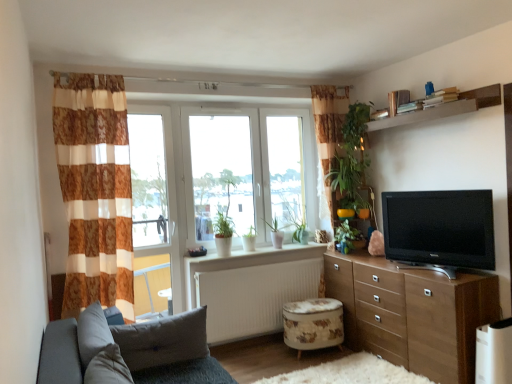
Describe the element at coordinates (227, 172) in the screenshot. I see `transparent glass window at center` at that location.

At what (x,y) coordinates should I click in order to perform the action: click on wooden chest of drawers at right. Please return your answer as a coordinate pair (x, y). Looking at the image, I should click on (413, 314).

This screenshot has width=512, height=384. Describe the element at coordinates (163, 340) in the screenshot. I see `gray fabric pillow at lower left` at that location.

What do you see at coordinates (313, 324) in the screenshot? The image size is (512, 384). I see `floral fabric ottoman at lower center` at bounding box center [313, 324].

What do you see at coordinates (296, 223) in the screenshot? I see `green matte plant at center, which is counted as the first plant, starting from the left` at bounding box center [296, 223].

Image resolution: width=512 pixels, height=384 pixels. Find the location of `transparent glass window at center`. transparent glass window at center is located at coordinates (227, 172).

Considering the relative sizes of white ceramic pots at center and wooden chest of drawers at right in the image provided, is white ceramic pots at center wider than wooden chest of drawers at right?

Incorrect, the width of white ceramic pots at center does not surpass that of wooden chest of drawers at right.

Could wooden chest of drawers at right be considered to be inside white ceramic pots at center?

That's incorrect, wooden chest of drawers at right is not inside white ceramic pots at center.

Based on the photo, from the image's perspective, is white ceramic pots at center above or below wooden chest of drawers at right?

white ceramic pots at center is above wooden chest of drawers at right.

Which is less distant, (277,257) or (423,348)?

Point (277,257) is positioned farther from the camera compared to point (423,348).

Who is taller, white plastic air purifier at lower right or wooden chest of drawers at right?

wooden chest of drawers at right is taller.

There is a white plastic air purifier at lower right. What are the coordinates of `the chest of drawers above it (from a real-world perspective)` in the screenshot? It's located at (413, 314).

Considering the relative positions of white plastic air purifier at lower right and wooden chest of drawers at right in the image provided, is white plastic air purifier at lower right to the right of wooden chest of drawers at right from the viewer's perspective?

Yes.

Between point (488, 351) and point (370, 277), which one is positioned behind?

Positioned behind is point (370, 277).

Are wooden chest of drawers at right and green matte plant at center, which is counted as the first plant, starting from the left, far apart?

That's right, there is a large distance between wooden chest of drawers at right and green matte plant at center, which is counted as the first plant, starting from the left.

Identify the location of chest of drawers lying on the right of green matte plant at center, which is counted as the first plant, starting from the left. Image resolution: width=512 pixels, height=384 pixels. (413, 314).

Do you think wooden chest of drawers at right is within green matte plant at center, which is counted as the first plant, starting from the left, or outside of it?

The correct answer is: outside.

Consider the image. Which object is more forward, floral fabric ottoman at lower center or white plastic window frame at left?

floral fabric ottoman at lower center is more forward.

Which is nearer, (328, 338) or (173, 241)?

Point (328, 338) appears to be closer to the viewer than point (173, 241).

Could you tell me if floral fabric ottoman at lower center is facing white plastic window frame at left?

No, floral fabric ottoman at lower center is not aimed at white plastic window frame at left.

From the image's perspective, would you say floral fabric ottoman at lower center is shown under white plastic window frame at left?

Indeed, from the image's perspective, floral fabric ottoman at lower center is shown beneath white plastic window frame at left.

How many degrees apart are the facing directions of white matte radiator at center and transparent glass window at center?

The angular difference between white matte radiator at center and transparent glass window at center is 0.216 degrees.

Which of these two, white matte radiator at center or transparent glass window at center, is bigger?

transparent glass window at center.

Is transparent glass window at center a part of white matte radiator at center?

No, transparent glass window at center is not surrounded by white matte radiator at center.

Between white matte radiator at center and transparent glass window at center, which one has more height?

transparent glass window at center.

Is wooden chest of drawers at right facing away from white plastic window frame at left?

No, wooden chest of drawers at right is not facing the opposite direction of white plastic window frame at left.

Considering the sizes of objects wooden chest of drawers at right and white plastic window frame at left in the image provided, who is bigger, wooden chest of drawers at right or white plastic window frame at left?

wooden chest of drawers at right is bigger.

Between wooden chest of drawers at right and white plastic window frame at left, which one is positioned behind?

white plastic window frame at left is behind.

Considering the positions of point (330, 291) and point (165, 293), is point (330, 291) closer or farther from the camera than point (165, 293)?

Clearly, point (330, 291) is closer to the camera than point (165, 293).

Can you see brown wooden shelf at upper right touching white ceramic pots at center?

They are not placed beside each other.

In the scene shown: Who is smaller, brown wooden shelf at upper right or white ceramic pots at center?

white ceramic pots at center.

Considering the relative positions of brown wooden shelf at upper right and white ceramic pots at center in the image provided, is brown wooden shelf at upper right to the left of white ceramic pots at center from the viewer's perspective?

No, brown wooden shelf at upper right is not to the left of white ceramic pots at center.

Locate an element on the screen. The image size is (512, 384). shelf above the white ceramic pots at center (from the image's perspective) is located at coordinates (444, 108).

Where is `window sill behind the wooden chest of drawers at right`? The height and width of the screenshot is (384, 512). window sill behind the wooden chest of drawers at right is located at coordinates (259, 256).

The height and width of the screenshot is (384, 512). Find the location of `appliance below the wooden chest of drawers at right (from a real-world perspective)`. appliance below the wooden chest of drawers at right (from a real-world perspective) is located at coordinates (494, 352).

Estimate the real-world distances between objects in this image. Which object is closer to gray fabric pillow at lower left, green matte plant at center, acting as the second plant starting from the right, or brown/white striped curtain at left?

Based on the image, brown/white striped curtain at left appears to be nearer to gray fabric pillow at lower left.

Considering their positions, is black glossy tv at right positioned closer to green matte plant at center, which is the first plant from back to front, than white ceramic pots at center?

white ceramic pots at center.

From the image, which object appears to be nearer to white matte radiator at center, brown wooden shelf at upper right or floral fabric ottoman at lower center?

Based on the image, floral fabric ottoman at lower center appears to be nearer to white matte radiator at center.

Consider the image. Which object lies further to the anchor point gray fabric pillow at lower left, transparent glass window at center or white plastic window frame at left?

Based on the image, transparent glass window at center appears to be further to gray fabric pillow at lower left.

Which object lies further to the anchor point white matte radiator at center, brown/white striped curtain at left or white plastic air purifier at lower right?

Based on the image, white plastic air purifier at lower right appears to be further to white matte radiator at center.

When comparing their distances from white ceramic pots at center, does white plastic air purifier at lower right or green matte plant at center, the 1th plant in the right-to-left sequence, seem further?

Based on the image, white plastic air purifier at lower right appears to be further to white ceramic pots at center.

From the image, which object appears to be farther from fluffy white rug at lower center, white ceramic pots at center or green matte plant at center, acting as the second plant starting from the right?

Based on the image, green matte plant at center, acting as the second plant starting from the right, appears to be further to fluffy white rug at lower center.

Considering their positions, is white plastic air purifier at lower right positioned closer to floral fabric ottoman at lower center than black glossy tv at right?

black glossy tv at right lies closer to floral fabric ottoman at lower center than the other object.

Find the location of `plant between fluffy white rug at lower center and green matte plant at center, which is counted as the first plant, starting from the left, along the z-axis`. plant between fluffy white rug at lower center and green matte plant at center, which is counted as the first plant, starting from the left, along the z-axis is located at coordinates pos(346,237).

You are a GUI agent. You are given a task and a screenshot of the screen. Output one action in this format:
    pyautogui.click(x=<x>, y=<y>)
    Task: Click on the shelf located between white plastic window frame at left and black glossy tv at right in the left-right direction
    
    Given the screenshot: What is the action you would take?
    pyautogui.click(x=444, y=108)

Where is `television between white ceramic pots at center and white plastic air purifier at lower right`? television between white ceramic pots at center and white plastic air purifier at lower right is located at coordinates (440, 229).

The image size is (512, 384). What are the coordinates of `stool between white ceramic pots at center and white plastic air purifier at lower right in the horizontal direction` in the screenshot? It's located at (313, 324).